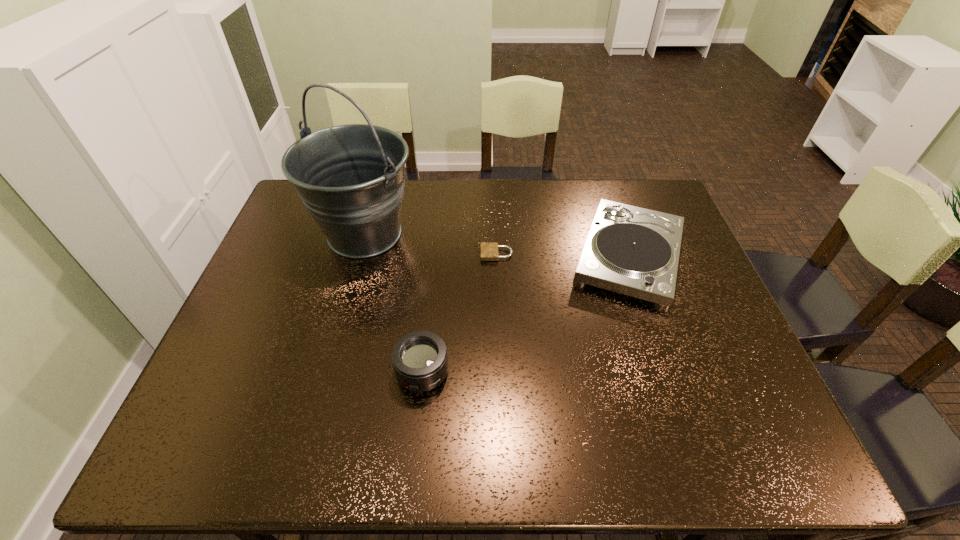
Locate an element on the screen. the tallest object is located at coordinates (351, 178).

Locate an element on the screen. This screenshot has width=960, height=540. record player is located at coordinates tap(634, 251).

You are a GUI agent. You are given a task and a screenshot of the screen. Output one action in this format:
    pyautogui.click(x=<x>, y=<y>)
    Task: Click on the telephoto lens
    This screenshot has width=960, height=540.
    Given the screenshot: What is the action you would take?
    pyautogui.click(x=419, y=358)

This screenshot has width=960, height=540. Identify the location of the shortest object. (489, 250).

The height and width of the screenshot is (540, 960). In order to click on the third object from left to right in this screenshot , I will do `click(489, 250)`.

You are a GUI agent. You are given a task and a screenshot of the screen. Output one action in this format:
    pyautogui.click(x=<x>, y=<y>)
    Task: Click on the vacant space located on the back of the tallest object
    Image resolution: width=960 pixels, height=540 pixels.
    Given the screenshot: What is the action you would take?
    pyautogui.click(x=379, y=181)

Locate an element on the screen. vacant area situated 0.090m on the left of the rightmost object is located at coordinates (536, 257).

This screenshot has height=540, width=960. I want to click on vacant space located 0.070m on the side of the telephoto lens with brand markings and control switches, so click(417, 428).

Identify the location of vacant space located on the keyhole side of the third object from left to right. (422, 254).

You are a GUI agent. You are given a task and a screenshot of the screen. Output one action in this format:
    pyautogui.click(x=<x>, y=<y>)
    Task: Click on the free space located on the keyhole side of the third object from left to right
    
    Given the screenshot: What is the action you would take?
    pyautogui.click(x=419, y=254)